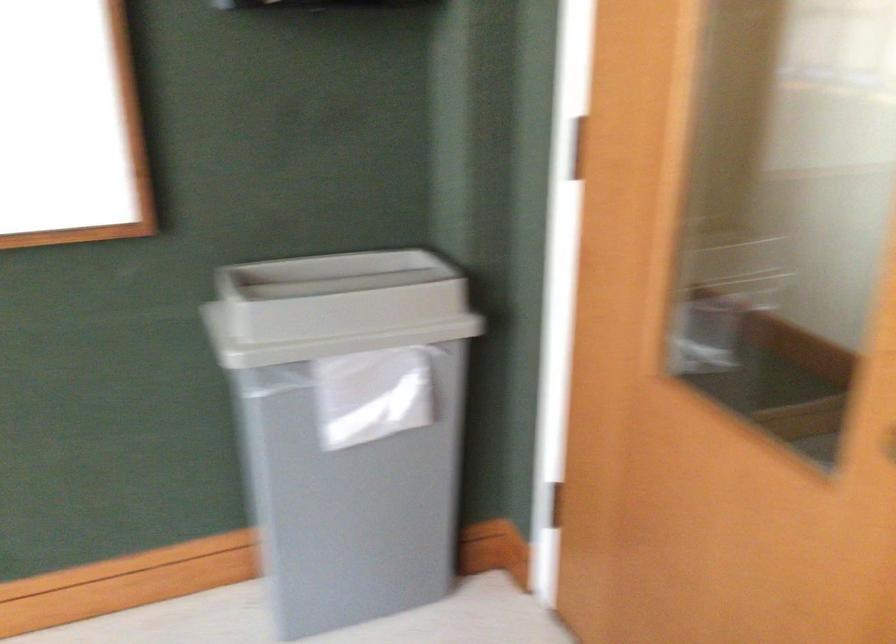
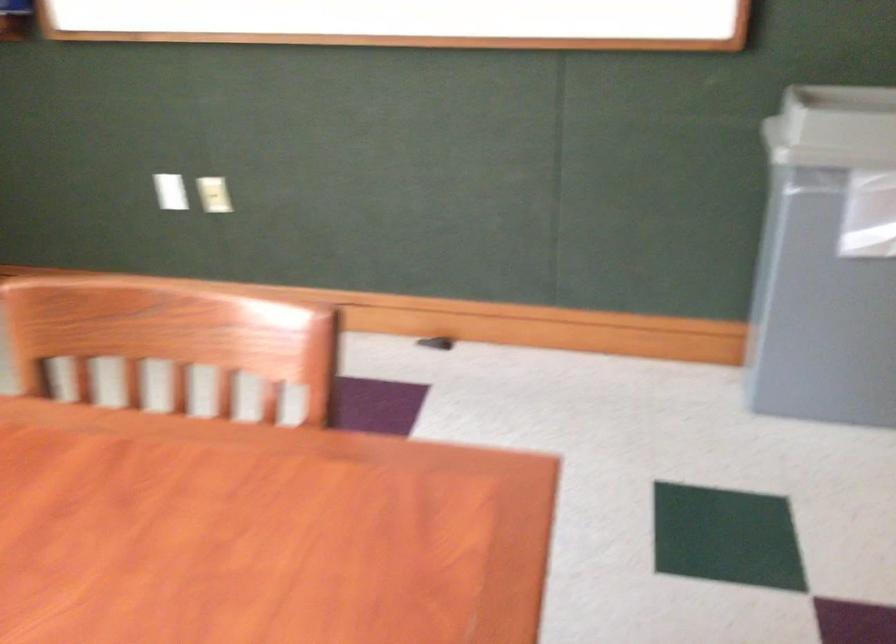
Question: The first image is from the beginning of the video and the second image is from the end. How did the camera likely rotate when shooting the video?

Choices:
 (A) Left
 (B) Right
 (C) Up
 (D) Down

Answer: (A)